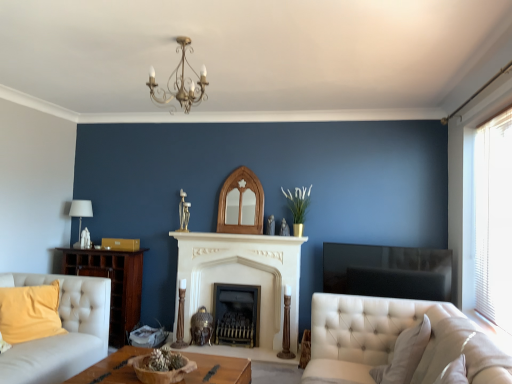
Describe the element at coordinates (494, 219) in the screenshot. I see `white blinds at right` at that location.

What do you see at coordinates (236, 314) in the screenshot?
I see `black matte fireplace at center, which is the second fireplace in left-to-right order` at bounding box center [236, 314].

The image size is (512, 384). Identify the location of velvet yellow pillow at lower left, placed as the 2th pillow when sorted from right to left. (30, 312).

Image resolution: width=512 pixels, height=384 pixels. Describe the element at coordinates (180, 81) in the screenshot. I see `gold metallic chandelier at upper center` at that location.

Find the location of a particular element. The height and width of the screenshot is (384, 512). wooden bowl at center is located at coordinates (218, 370).

The height and width of the screenshot is (384, 512). I want to click on white blinds at right, so click(494, 219).

Considering the relative positions of white blinds at right and black matte fireplace at center, which is the 1th fireplace in right-to-left order, in the image provided, is white blinds at right in front of black matte fireplace at center, which is the 1th fireplace in right-to-left order,?

That is True.

Identify the location of the 2nd fireplace below the white blinds at right (from a real-world perspective). The width and height of the screenshot is (512, 384). (236, 314).

Are white blinds at right and black matte fireplace at center, which is the second fireplace in left-to-right order, making contact?

No, white blinds at right is not with black matte fireplace at center, which is the second fireplace in left-to-right order.

Which of these two, white fabric lampshade at left or white stone fireplace at center, which is the second fireplace in right-to-left order, stands taller?

white stone fireplace at center, which is the second fireplace in right-to-left order.

From the image's perspective, is white fabric lampshade at left positioned above or below white stone fireplace at center, the first fireplace from the left?

white fabric lampshade at left is situated higher than white stone fireplace at center, the first fireplace from the left, in the image.

There is a white fabric lampshade at left. In order to click on the 1st fireplace below it (from the image's perspective) in this screenshot , I will do `click(243, 276)`.

Are gray fabric pillow at lower right, which is the first pillow from right to left, and velvet yellow pillow at lower left, marked as the first pillow in a left-to-right arrangement, far apart?

Yes, gray fabric pillow at lower right, which is the first pillow from right to left, is far from velvet yellow pillow at lower left, marked as the first pillow in a left-to-right arrangement.

Which is in front, point (389, 382) or point (5, 331)?

The point (389, 382) is more forward.

Is velvet yellow pillow at lower left, the second pillow when ordered from front to back, at the back of gray fabric pillow at lower right, arranged as the 1th pillow when viewed from the front?

gray fabric pillow at lower right, arranged as the 1th pillow when viewed from the front, is not turned away from velvet yellow pillow at lower left, the second pillow when ordered from front to back.

Does gray fabric pillow at lower right, which is the 2th pillow from back to front, have a greater height compared to velvet yellow pillow at lower left, placed as the 2th pillow when sorted from right to left?

Yes, gray fabric pillow at lower right, which is the 2th pillow from back to front, is taller than velvet yellow pillow at lower left, placed as the 2th pillow when sorted from right to left.

Is black matte fireplace at center, which is the 1th fireplace in right-to-left order, inside or outside of gray fabric pillow at lower right, acting as the second pillow starting from the left?

black matte fireplace at center, which is the 1th fireplace in right-to-left order, cannot be found inside gray fabric pillow at lower right, acting as the second pillow starting from the left.

Would you consider black matte fireplace at center, which is the second fireplace in left-to-right order, to be distant from gray fabric pillow at lower right, acting as the second pillow starting from the left?

Yes, black matte fireplace at center, which is the second fireplace in left-to-right order, is far from gray fabric pillow at lower right, acting as the second pillow starting from the left.

Which is more to the right, black matte fireplace at center, which is the second fireplace in left-to-right order, or gray fabric pillow at lower right, which is the 2th pillow from back to front?

Positioned to the right is gray fabric pillow at lower right, which is the 2th pillow from back to front.

Consider the image. How much distance is there between black matte fireplace at center, which is the second fireplace in left-to-right order, and gray fabric pillow at lower right, arranged as the 1th pillow when viewed from the front?

1.74 meters.

Considering the relative positions of white stone fireplace at center, which is the second fireplace in right-to-left order, and white marble fireplace at center in the image provided, is white stone fireplace at center, which is the second fireplace in right-to-left order, to the left of white marble fireplace at center from the viewer's perspective?

Yes.

Looking at this image, from the image's perspective, who appears lower, white stone fireplace at center, the first fireplace from the left, or white marble fireplace at center?

white stone fireplace at center, the first fireplace from the left, is shown below in the image.

How different are the orientations of white stone fireplace at center, the first fireplace from the left, and white marble fireplace at center in degrees?

0.62 degrees separate the facing orientations of white stone fireplace at center, the first fireplace from the left, and white marble fireplace at center.

In the scene shown: From a real-world perspective, between white stone fireplace at center, the first fireplace from the left, and white marble fireplace at center, who is vertically lower?

white stone fireplace at center, the first fireplace from the left, from a real-world perspective.

Is point (221, 316) farther from viewer compared to point (437, 304)?

Yes.

From the image's perspective, is black matte fireplace at center, which is the second fireplace in left-to-right order, located above or below white tufted fabric couch at lower right?

Clearly, from the image's perspective, black matte fireplace at center, which is the second fireplace in left-to-right order, is below white tufted fabric couch at lower right.

From a real-world perspective, is black matte fireplace at center, which is the 1th fireplace in right-to-left order, physically located above or below white tufted fabric couch at lower right?

Clearly, from a real-world perspective, black matte fireplace at center, which is the 1th fireplace in right-to-left order, is below white tufted fabric couch at lower right.

Can you confirm if black matte fireplace at center, which is the second fireplace in left-to-right order, is smaller than white tufted fabric couch at lower right?

Correct, black matte fireplace at center, which is the second fireplace in left-to-right order, occupies less space than white tufted fabric couch at lower right.

Considering the relative sizes of black matte fireplace at center, which is the 1th fireplace in right-to-left order, and white fabric lampshade at left in the image provided, is black matte fireplace at center, which is the 1th fireplace in right-to-left order, wider than white fabric lampshade at left?

In fact, black matte fireplace at center, which is the 1th fireplace in right-to-left order, might be narrower than white fabric lampshade at left.

In the image, is black matte fireplace at center, which is the second fireplace in left-to-right order, on the left side or the right side of white fabric lampshade at left?

In the image, black matte fireplace at center, which is the second fireplace in left-to-right order, appears on the right side of white fabric lampshade at left.

Which object is further away from the camera taking this photo, black matte fireplace at center, which is the 1th fireplace in right-to-left order, or white fabric lampshade at left?

white fabric lampshade at left is more distant.

From the white blinds at right, count the 1st fireplace to the left and point to it. Please provide its 2D coordinates.

[(236, 314)]

What are the coordinates of `fireplace that is the 1st one when counting downward from the white fabric lampshade at left (from the image's perspective)` in the screenshot? It's located at (243, 276).

Based on their spatial positions, is wooden bowl at center or white fabric lampshade at left further from gray fabric pillow at lower right, which is the first pillow from right to left?

The object further to gray fabric pillow at lower right, which is the first pillow from right to left, is white fabric lampshade at left.

Which object lies further to the anchor point gold metallic chandelier at upper center, velvet yellow pillow at lower left, acting as the first pillow starting from the back, or white fabric lampshade at left?

The object further to gold metallic chandelier at upper center is white fabric lampshade at left.

Looking at this image, looking at the image, which one is located further to gold metallic chandelier at upper center, white stone fireplace at center, which is the second fireplace in right-to-left order, or white tufted fabric couch at lower right?

white stone fireplace at center, which is the second fireplace in right-to-left order.

Considering their positions, is gray fabric pillow at lower right, which is the 2th pillow from back to front, positioned closer to white fabric lampshade at left than white marble fireplace at center?

white marble fireplace at center is positioned closer to the anchor white fabric lampshade at left.

Considering their positions, is black matte fireplace at center, which is the second fireplace in left-to-right order, positioned closer to velvet yellow pillow at lower left, the second pillow when ordered from front to back, than white fabric lampshade at left?

white fabric lampshade at left.

Estimate the real-world distances between objects in this image. Which object is closer to white blinds at right, velvet yellow pillow at lower left, placed as the 2th pillow when sorted from right to left, or white fabric lampshade at left?

Based on the image, velvet yellow pillow at lower left, placed as the 2th pillow when sorted from right to left, appears to be nearer to white blinds at right.

Looking at the image, which one is located closer to gold metallic chandelier at upper center, white blinds at right or white tufted fabric couch at lower right?

white tufted fabric couch at lower right lies closer to gold metallic chandelier at upper center than the other object.

From the image, which object appears to be farther from white blinds at right, black matte fireplace at center, which is the 1th fireplace in right-to-left order, or white marble fireplace at center?

Based on the image, black matte fireplace at center, which is the 1th fireplace in right-to-left order, appears to be further to white blinds at right.

Identify the location of pillow between white marble fireplace at center and white blinds at right in the horizontal direction. (404, 355).

Image resolution: width=512 pixels, height=384 pixels. Identify the location of window positioned between white tufted fabric couch at lower right and black matte fireplace at center, which is the second fireplace in left-to-right order, from near to far. (494, 219).

The height and width of the screenshot is (384, 512). I want to click on window located between white tufted fabric couch at lower right and white stone fireplace at center, the first fireplace from the left, in the depth direction, so click(494, 219).

Image resolution: width=512 pixels, height=384 pixels. I want to click on table between white tufted fabric couch at lower right and white fabric lampshade at left from front to back, so click(x=218, y=370).